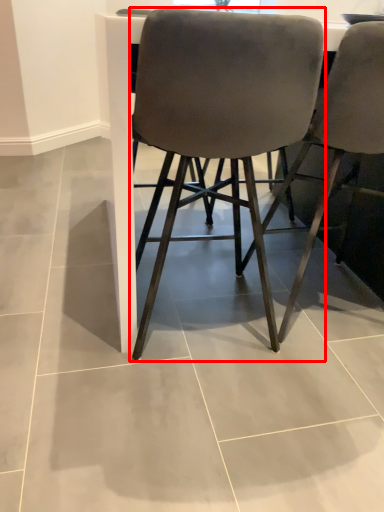
Question: Where is chair (annotated by the red box) located in relation to chair in the image?

Choices:
 (A) right
 (B) left

Answer: (B)